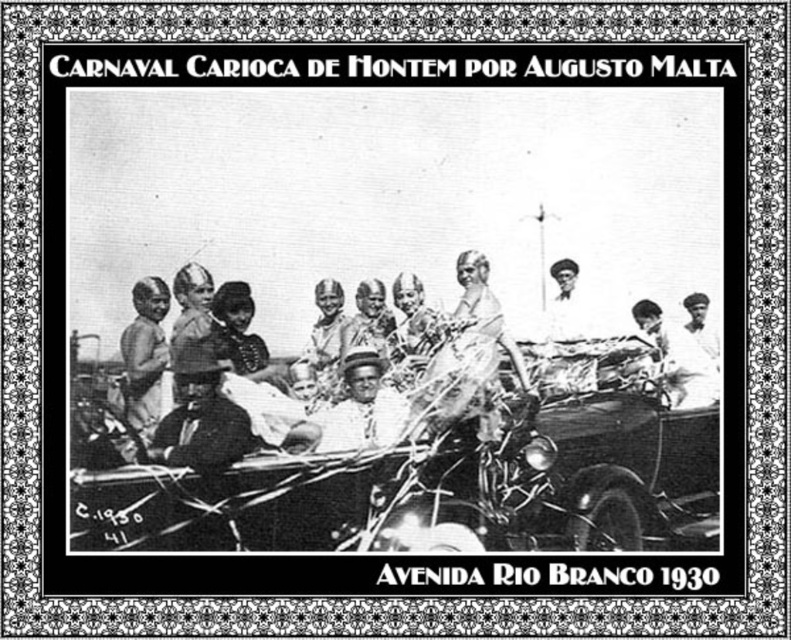
Is smooth black suit at center closer to the viewer compared to white cotton shirt at center?

That is True.

Between point (195, 448) and point (346, 360), which one is positioned behind?

The point (346, 360) is behind.

At what (x,y) coordinates should I click in order to perform the action: click on smooth black suit at center. Please return your answer as a coordinate pair (x, y). The image size is (791, 640). Looking at the image, I should click on (199, 417).

Does shiny chrome car at center lie in front of smooth black suit at center?

Yes, it is in front of smooth black suit at center.

Is shiny chrome car at center above smooth black suit at center?

Actually, shiny chrome car at center is below smooth black suit at center.

Who is more forward, (706, 412) or (161, 442)?

Point (161, 442) is more forward.

Locate an element on the screen. Image resolution: width=791 pixels, height=640 pixels. shiny chrome car at center is located at coordinates (445, 481).

Is shiny chrome car at center below white cotton shirt at center?

Actually, shiny chrome car at center is above white cotton shirt at center.

Does point (331, 532) come farther from viewer compared to point (358, 413)?

No, (331, 532) is in front of (358, 413).

Which is behind, point (256, 529) or point (350, 364)?

The point (350, 364) is behind.

Where is `shiny chrome car at center`? shiny chrome car at center is located at coordinates (445, 481).